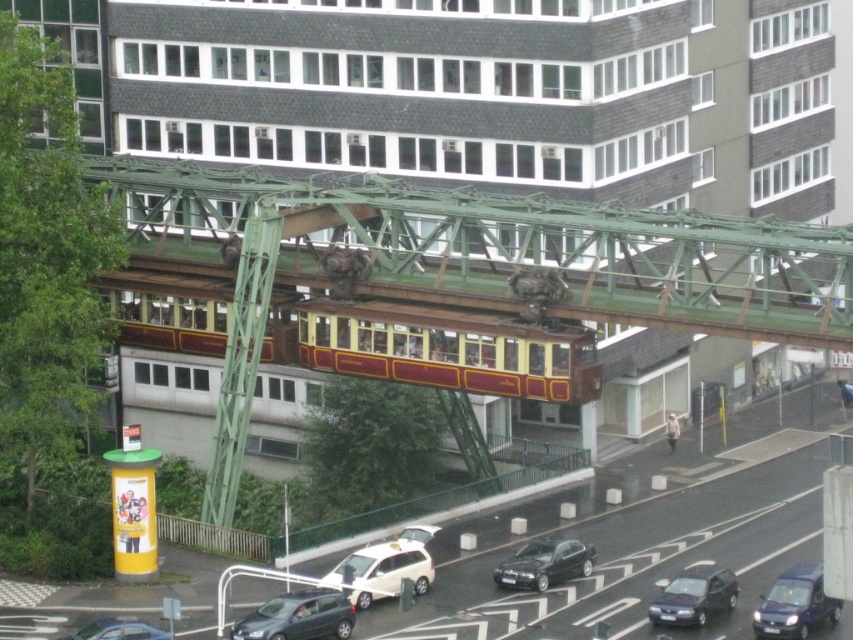
Who is lower down, metallic blue van at lower right or shiny black car at lower center?

metallic blue van at lower right

Between metallic blue van at lower right and shiny black car at lower center, which one appears on the right side from the viewer's perspective?

metallic blue van at lower right is more to the right.

Who is more distant from viewer, (x=795, y=618) or (x=540, y=580)?

The point (x=540, y=580) is behind.

I want to click on metallic blue van at lower right, so click(795, 604).

Does point (691, 241) come behind point (671, 596)?

No.

Is green metallic bridge at center further to camera compared to matte black car at lower right?

No, it is not.

Which is behind, point (805, 250) or point (723, 577)?

The point (723, 577) is more distant.

Where is `green metallic bridge at center`? green metallic bridge at center is located at coordinates (486, 250).

Where is `polished brass tram at center`? polished brass tram at center is located at coordinates (434, 348).

Is point (366, 316) closer to camera compared to point (270, 602)?

No, it is behind (270, 602).

The height and width of the screenshot is (640, 853). Find the location of `polished brass tram at center`. polished brass tram at center is located at coordinates (434, 348).